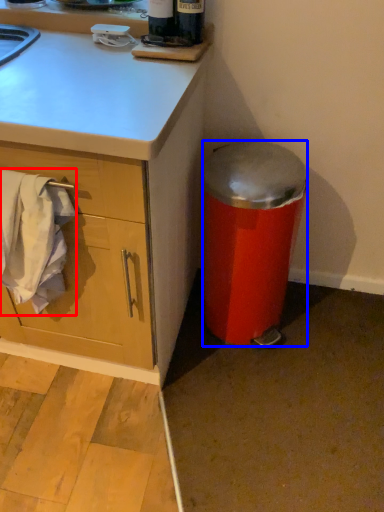
Question: Which point is closer to the camera, laundry (highlighted by a red box) or trash bin/can (highlighted by a blue box)?

Choices:
 (A) laundry
 (B) trash bin/can

Answer: (A)